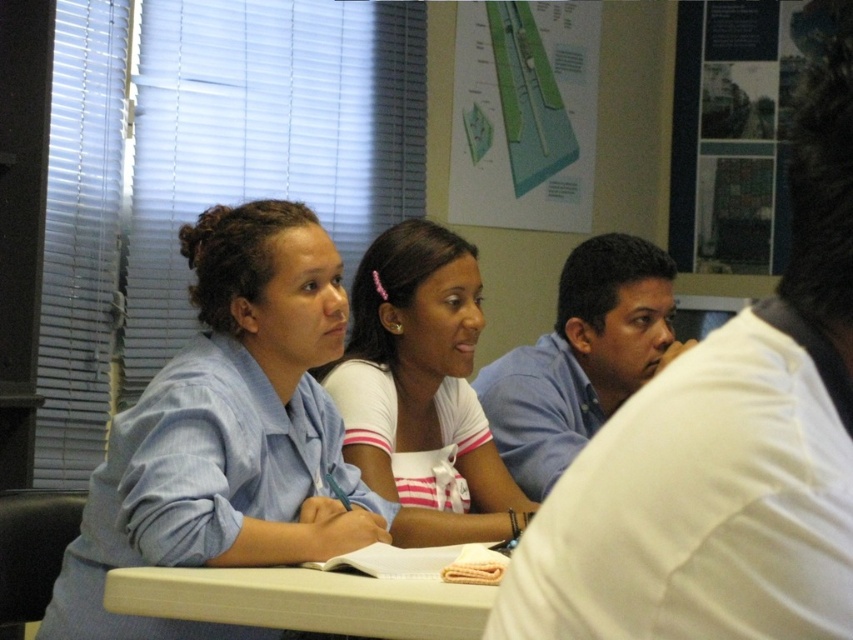
Question: Among these points, which one is farthest from the camera?

Choices:
 (A) (405, 266)
 (B) (264, 573)

Answer: (A)

Question: Which point is farther to the camera?

Choices:
 (A) (654, 618)
 (B) (187, 394)
 (C) (352, 378)
 (D) (328, 612)

Answer: (C)

Question: Which point is farther to the camera?

Choices:
 (A) white plastic table at lower center
 (B) blue shirt at center

Answer: (A)

Question: Is white matte shirt at center to the left of white plastic table at lower center from the viewer's perspective?

Choices:
 (A) yes
 (B) no

Answer: (B)

Question: Observing the image, what is the correct spatial positioning of white matte shirt at center in reference to white plastic table at lower center?

Choices:
 (A) below
 (B) above

Answer: (B)

Question: Is blue striped shirt at upper left bigger than white matte shirt at center?

Choices:
 (A) yes
 (B) no

Answer: (A)